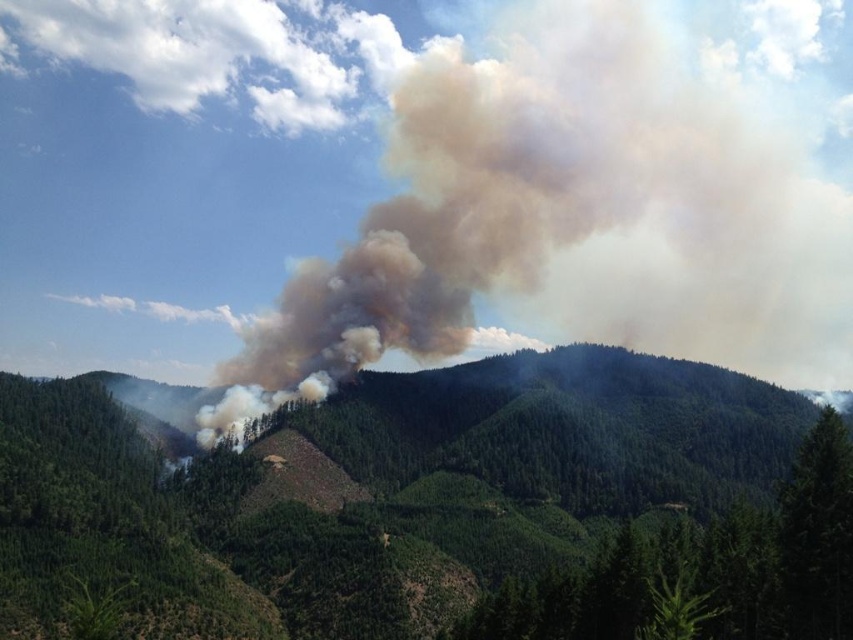
Is point (16, 394) farther from camera compared to point (410, 282)?

That is False.

Does green forested mountain at center lie in front of brown smoke at center?

Yes, green forested mountain at center is closer to the viewer.

Is point (132, 433) behind point (337, 262)?

That is False.

Where is `green forested mountain at center`? green forested mountain at center is located at coordinates (430, 506).